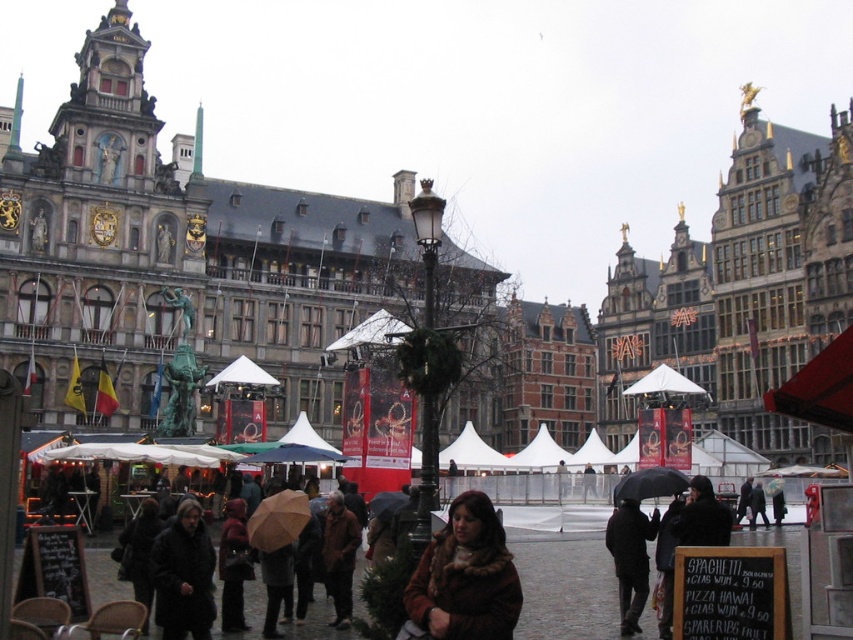
You are a customer looking for a coat to buy at the market. You see the brown fur coat at center and the dark brown leather coat at lower left. Which coat is positioned higher in the scene?

The brown fur coat at center is positioned higher than the dark brown leather coat at lower left.

You are a customer at the market and want to try on both the dark matte coat at lower center and the brown woolen coat at center. Which coat should you try on first if you want to try the taller one first?

The dark matte coat at lower center is taller than the brown woolen coat at center, so you should try on the dark matte coat at lower center first.